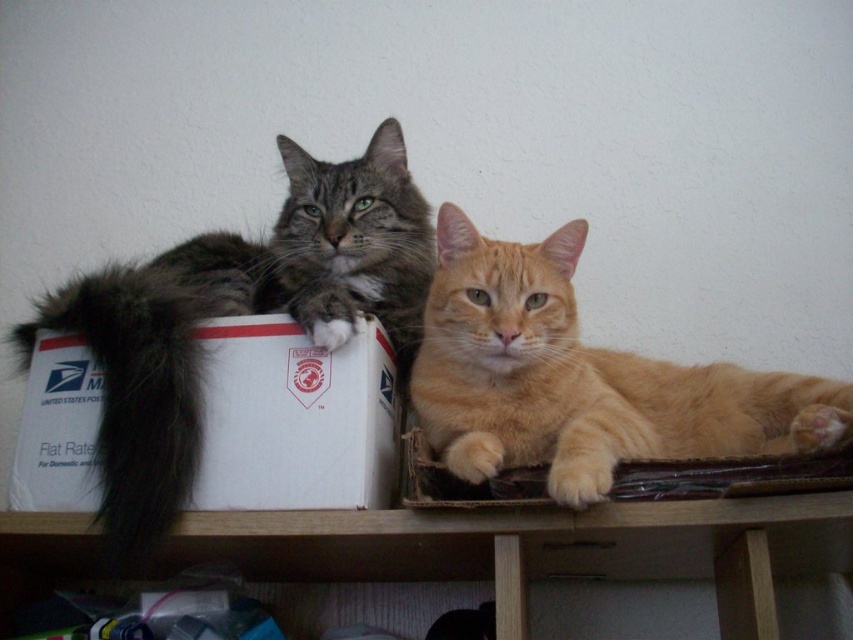
Which of these two, gray fluffy cat at left or white cardboard box at left, stands taller?

gray fluffy cat at left

Who is lower down, gray fluffy cat at left or white cardboard box at left?

Positioned lower is white cardboard box at left.

Describe the element at coordinates (236, 314) in the screenshot. I see `gray fluffy cat at left` at that location.

Image resolution: width=853 pixels, height=640 pixels. I want to click on gray fluffy cat at left, so click(236, 314).

Is orange fur cat at center below white cardboard box at left?

No.

Where is `orange fur cat at center`? This screenshot has height=640, width=853. orange fur cat at center is located at coordinates (578, 380).

Between point (563, 352) and point (299, 380), which one is positioned behind?

The point (299, 380) is behind.

The height and width of the screenshot is (640, 853). In order to click on orange fur cat at center in this screenshot , I will do `click(578, 380)`.

Is orange fur cat at center positioned before wooden shelf at lower center?

Yes, orange fur cat at center is in front of wooden shelf at lower center.

Measure the distance between orange fur cat at center and wooden shelf at lower center.

orange fur cat at center and wooden shelf at lower center are 7.94 inches apart.

Locate an element on the screen. This screenshot has width=853, height=640. orange fur cat at center is located at coordinates (578, 380).